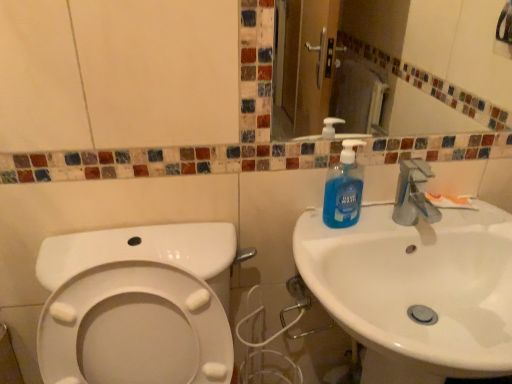
Question: Is white glossy sink at right aimed at blue liquid soap at sink right?

Choices:
 (A) yes
 (B) no

Answer: (B)

Question: From a real-world perspective, is white glossy sink at right located higher than blue liquid soap at sink right?

Choices:
 (A) yes
 (B) no

Answer: (B)

Question: Considering the relative sizes of white glossy sink at right and blue liquid soap at sink right in the image provided, is white glossy sink at right taller than blue liquid soap at sink right?

Choices:
 (A) no
 (B) yes

Answer: (B)

Question: Can you confirm if white glossy sink at right is bigger than blue liquid soap at sink right?

Choices:
 (A) no
 (B) yes

Answer: (B)

Question: Is white glossy sink at right in front of blue liquid soap at sink right?

Choices:
 (A) no
 (B) yes

Answer: (B)

Question: Is the depth of white glossy sink at right greater than that of blue liquid soap at sink right?

Choices:
 (A) yes
 (B) no

Answer: (B)

Question: Would you say blue liquid soap at sink right is part of white matte toothpaste at sink right's contents?

Choices:
 (A) yes
 (B) no

Answer: (B)

Question: Are white matte toothpaste at sink right and blue liquid soap at sink right located far from each other?

Choices:
 (A) yes
 (B) no

Answer: (B)

Question: Considering the relative sizes of white matte toothpaste at sink right and blue liquid soap at sink right in the image provided, is white matte toothpaste at sink right taller than blue liquid soap at sink right?

Choices:
 (A) yes
 (B) no

Answer: (B)

Question: Could you tell me if white matte toothpaste at sink right is turned towards blue liquid soap at sink right?

Choices:
 (A) yes
 (B) no

Answer: (B)

Question: Is the depth of white matte toothpaste at sink right greater than that of blue liquid soap at sink right?

Choices:
 (A) no
 (B) yes

Answer: (B)

Question: From a real-world perspective, is white matte toothpaste at sink right physically below blue liquid soap at sink right?

Choices:
 (A) yes
 (B) no

Answer: (A)

Question: From the image's perspective, is white glossy sink at right over white matte toothpaste at sink right?

Choices:
 (A) no
 (B) yes

Answer: (A)